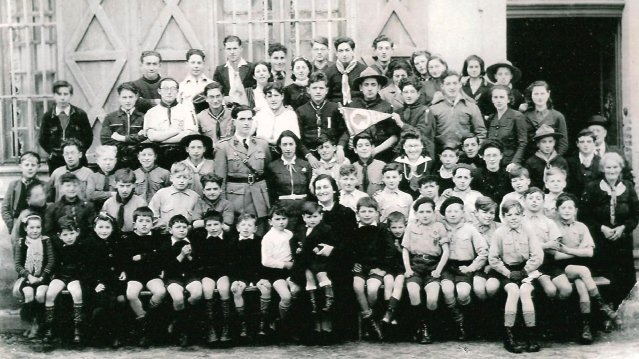
Find the location of a particular element. The height and width of the screenshot is (359, 639). doorway is located at coordinates (567, 64).